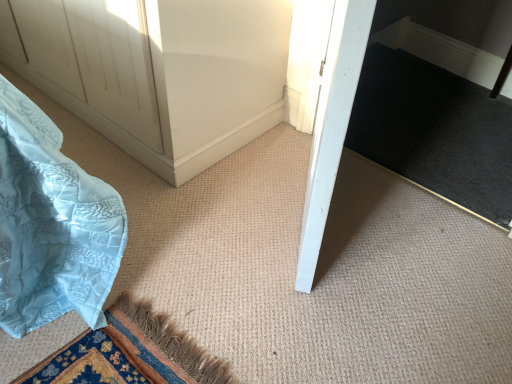
Question: Is white smooth door at center in front of or behind black carpet at center in the image?

Choices:
 (A) behind
 (B) front

Answer: (B)

Question: From the image's perspective, is white smooth door at center located above or below black carpet at center?

Choices:
 (A) above
 (B) below

Answer: (B)

Question: Is white smooth door at center situated inside black carpet at center or outside?

Choices:
 (A) inside
 (B) outside

Answer: (B)

Question: From their relative heights in the image, would you say black carpet at center is taller or shorter than white smooth door at center?

Choices:
 (A) short
 (B) tall

Answer: (A)

Question: Is point (424, 64) closer or farther from the camera than point (336, 61)?

Choices:
 (A) closer
 (B) farther

Answer: (B)

Question: From the image's perspective, is black carpet at center above or below white smooth door at center?

Choices:
 (A) below
 (B) above

Answer: (B)

Question: Is black carpet at center inside or outside of white smooth door at center?

Choices:
 (A) inside
 (B) outside

Answer: (B)